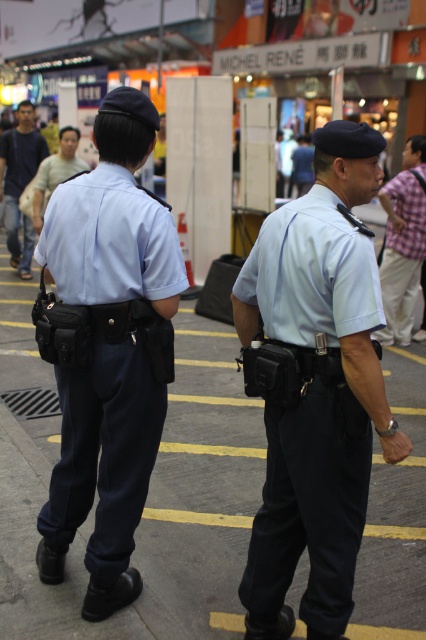
Question: Among these objects, which one is farthest from the camera?

Choices:
 (A) plaid shirt at right
 (B) light brown leather jacket at upper left

Answer: (B)

Question: Is gray concrete pavement at center to the left of light blue fabric uniform at center from the viewer's perspective?

Choices:
 (A) yes
 (B) no

Answer: (B)

Question: Is light blue fabric uniform at center further to the viewer compared to plaid shirt at right?

Choices:
 (A) yes
 (B) no

Answer: (B)

Question: Is light blue fabric shirt at center behind light brown leather jacket at upper left?

Choices:
 (A) no
 (B) yes

Answer: (A)

Question: Estimate the real-world distances between objects in this image. Which object is closer to the light blue fabric uniform at center?

Choices:
 (A) plaid shirt at right
 (B) light brown leather jacket at upper left
 (C) gray concrete pavement at center

Answer: (C)

Question: Which of the following is the closest to the observer?

Choices:
 (A) (307, 195)
 (B) (8, 248)
 (C) (423, 435)

Answer: (A)